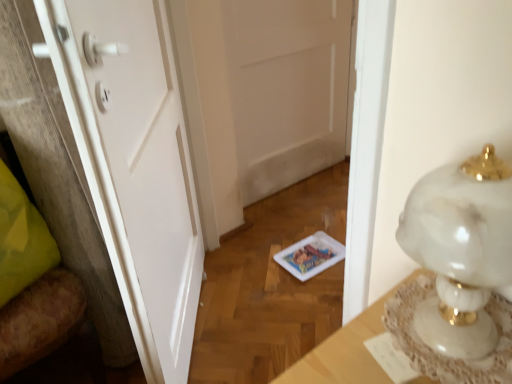
Question: Does white matte door at center, the first door when ordered from right to left, have a lesser width compared to wooden chair at left?

Choices:
 (A) no
 (B) yes

Answer: (B)

Question: From the image's perspective, is white matte door at center, acting as the first door starting from the back, over wooden chair at left?

Choices:
 (A) no
 (B) yes

Answer: (B)

Question: Would you say white matte door at center, which ranks as the 2th door in left-to-right order, is outside wooden chair at left?

Choices:
 (A) no
 (B) yes

Answer: (B)

Question: From a real-world perspective, is white matte door at center, the second door when ordered from front to back, positioned over wooden chair at left based on gravity?

Choices:
 (A) no
 (B) yes

Answer: (B)

Question: From the image's perspective, is white matte door at center, the second door when ordered from front to back, below wooden chair at left?

Choices:
 (A) no
 (B) yes

Answer: (A)

Question: Considering the relative sizes of white matte door at center, the first door when ordered from right to left, and wooden chair at left in the image provided, is white matte door at center, the first door when ordered from right to left, bigger than wooden chair at left?

Choices:
 (A) yes
 (B) no

Answer: (B)

Question: Can you confirm if white marble table at right is positioned to the right of white matte door at center, the 2th door when ordered from back to front?

Choices:
 (A) no
 (B) yes

Answer: (B)

Question: Is white marble table at right oriented away from white matte door at center, which is the 1th door from left to right?

Choices:
 (A) no
 (B) yes

Answer: (A)

Question: From a real-world perspective, is white marble table at right on white matte door at center, the 2th door when ordered from back to front?

Choices:
 (A) no
 (B) yes

Answer: (B)

Question: Is white marble table at right bigger than white matte door at center, the 1th door viewed from the front?

Choices:
 (A) no
 (B) yes

Answer: (A)

Question: Is white marble table at right positioned far away from white matte door at center, which is the 1th door from left to right?

Choices:
 (A) no
 (B) yes

Answer: (A)

Question: Does white marble table at right have a greater width compared to white matte door at center, the 2th door when ordered from back to front?

Choices:
 (A) no
 (B) yes

Answer: (B)

Question: Considering the relative sizes of white matte door at center, the first door when ordered from right to left, and white marble table at right in the image provided, is white matte door at center, the first door when ordered from right to left, bigger than white marble table at right?

Choices:
 (A) no
 (B) yes

Answer: (B)